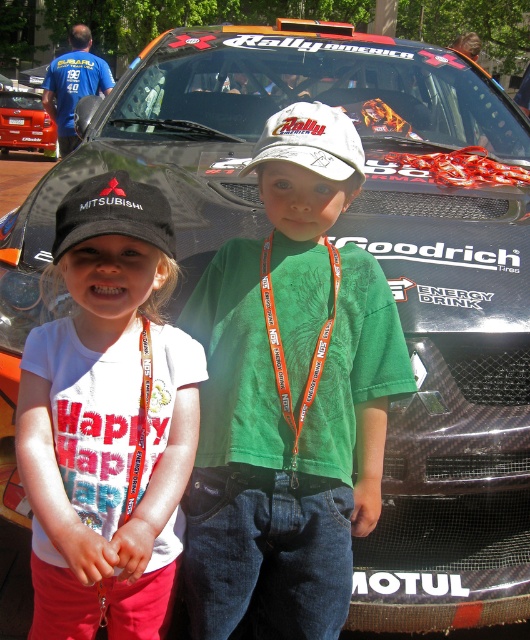
You are a photographer at the event and want to capture a photo of both the green fabric shirt at center and the black fabric cap at left without any obstruction. Based on their positions, which object should be moved forward to ensure both are visible?

The black fabric cap at left is behind the green fabric shirt at center, so moving the black fabric cap at left forward would ensure both are visible without obstruction.

You are a photographer at the rally car event and need to capture both the green fabric shirt at center and the orange lanyard at center in a single photo. Based on their positions, which object should you focus on first to ensure both are in frame?

The green fabric shirt at center is positioned on the left side of orange lanyard at center, so you should focus on the orange lanyard at center first to ensure both are in frame.

You are a photographer at the rally car event. You need to capture a photo where both the green fabric shirt at center and the black fabric cap at left are visible. Given their sizes, which object will appear taller in the photo?

The green fabric shirt at center will appear taller in the photo because it has a greater height compared to the black fabric cap at left as stated in the description.